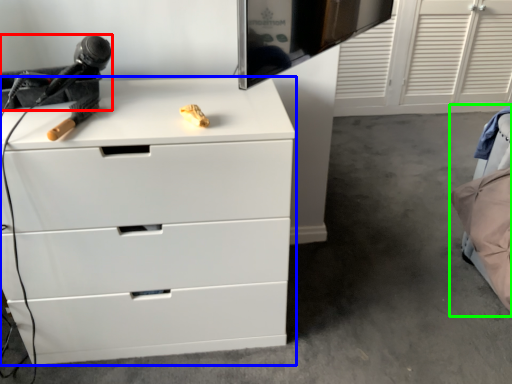
Question: Which is farther away from equipment (highlighted by a red box)? chest of drawers (highlighted by a blue box) or bed (highlighted by a green box)?

Choices:
 (A) chest of drawers
 (B) bed

Answer: (B)